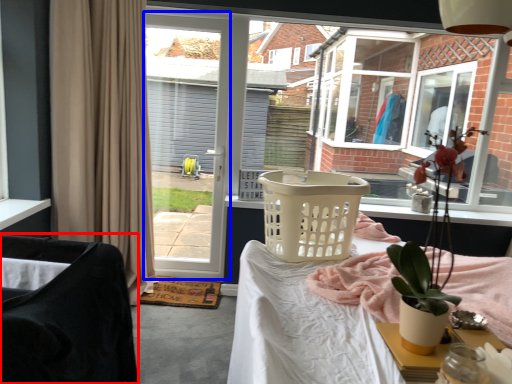
Question: Which of the following is the closest to the observer, chair (highlighted by a red box) or screen door (highlighted by a blue box)?

Choices:
 (A) chair
 (B) screen door

Answer: (A)